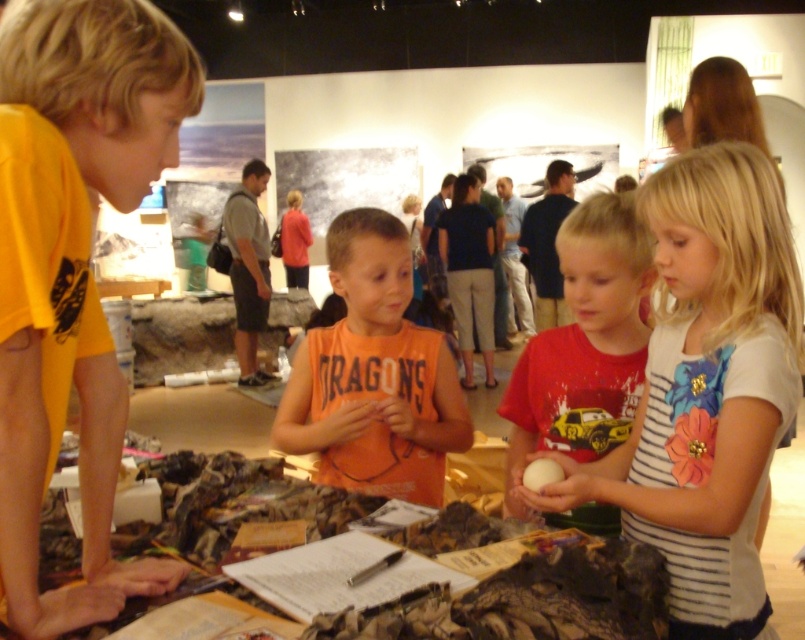
You are a museum guide observing the children at the table. You need to hand out a small prize to the child wearing the yellow matte shirt at left and the white striped shirt at center. If you have only one prize left, which child should you give it to based on their clothing size?

The yellow matte shirt at left has a smaller size compared to the white striped shirt at center, so you should give the prize to the child wearing the yellow matte shirt at left since their clothing size is smaller.

You are a parent trying to ensure your child doesn not accidentally knock over the white matte egg at center while reaching for the orange cotton shirt at center. Based on the distance between them, can you estimate if the child has enough space to move without causing the egg to fall?

The distance between the white matte egg at center and the orange cotton shirt at center is 13.73 inches, which is sufficient space for a child to move their hand without knocking over the egg.